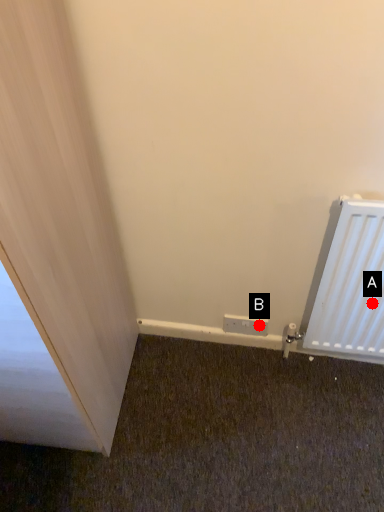
Question: Two points are circled on the image, labeled by A and B beside each circle. Which point is further to the camera?

Choices:
 (A) A is further
 (B) B is further

Answer: (B)